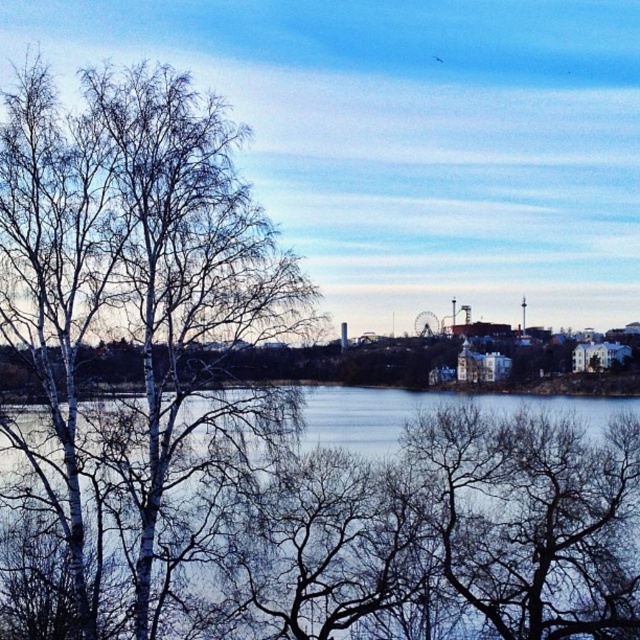
Does bare white tree at left have a larger size compared to blue water at center?

Incorrect, bare white tree at left is not larger than blue water at center.

Does bare white tree at left lie behind blue water at center?

That is False.

The height and width of the screenshot is (640, 640). In order to click on bare white tree at left in this screenshot , I will do `click(134, 353)`.

The image size is (640, 640). What are the coordinates of `bare white tree at left` in the screenshot? It's located at (134, 353).